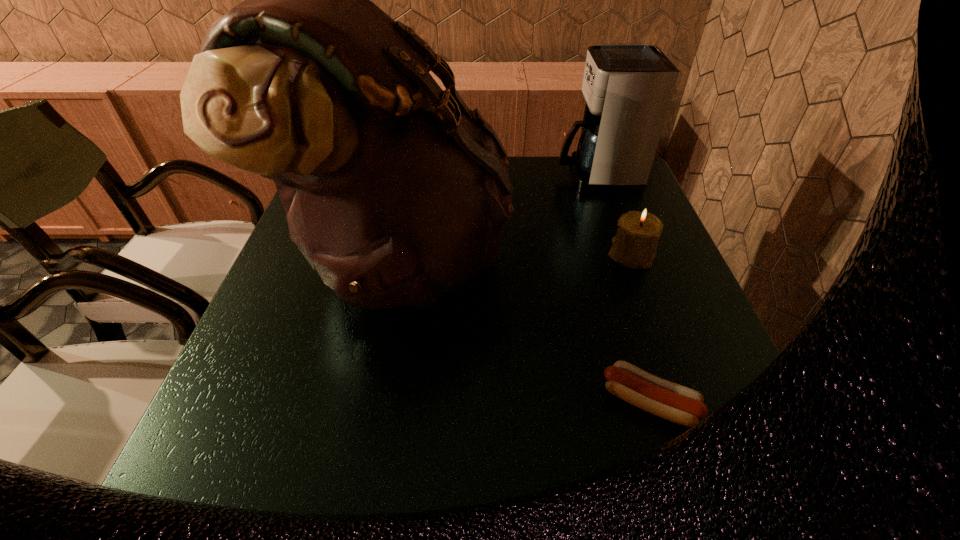
Find the location of a particular element. Image resolution: width=960 pixels, height=540 pixels. vacant space located 0.240m on the back of the candle_holder is located at coordinates (606, 186).

At what (x,y) coordinates should I click in order to perform the action: click on vacant space located on the back of the shortest object. Please return your answer as a coordinate pair (x, y). This screenshot has width=960, height=540. Looking at the image, I should click on (612, 279).

The image size is (960, 540). I want to click on satchel present at the far edge, so click(x=396, y=192).

Find the location of a particular element. This screenshot has width=960, height=540. coffee maker present at the far edge is located at coordinates (628, 87).

At what (x,y) coordinates should I click in order to perform the action: click on object that is at the left edge. Please return your answer as a coordinate pair (x, y). Looking at the image, I should click on (396, 192).

The height and width of the screenshot is (540, 960). Find the location of `coffee maker at the right edge`. coffee maker at the right edge is located at coordinates (628, 87).

Where is `candle_holder that is positioned at the right edge`? Image resolution: width=960 pixels, height=540 pixels. candle_holder that is positioned at the right edge is located at coordinates (634, 246).

Identify the location of sausage located in the right edge section of the desktop. (682, 405).

Image resolution: width=960 pixels, height=540 pixels. Find the location of `object that is at the far left corner`. object that is at the far left corner is located at coordinates (396, 192).

Where is `object at the far right corner`? The height and width of the screenshot is (540, 960). object at the far right corner is located at coordinates (628, 87).